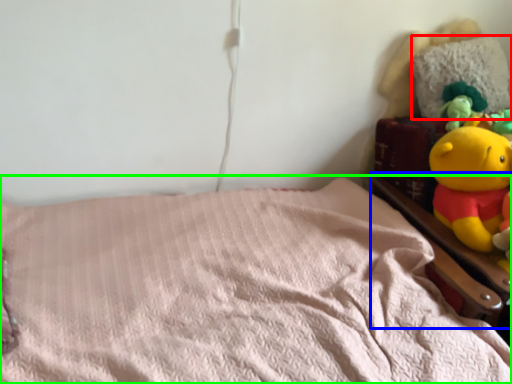
Question: Which object is the farthest from pillow (highlighted by a red box)? Choose among these: bed frame (highlighted by a blue box) or bed (highlighted by a green box).

Choices:
 (A) bed frame
 (B) bed

Answer: (B)